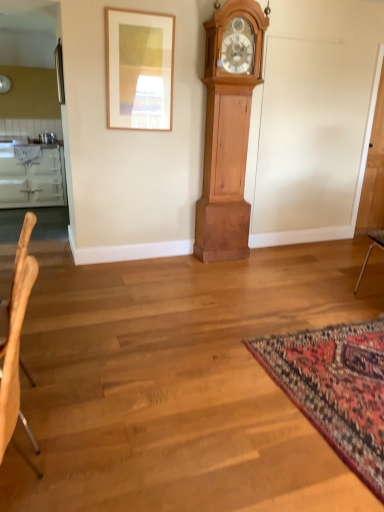
Question: Can you confirm if light brown wood chair at left is wider than carpet with intricate patterns at lower right?

Choices:
 (A) yes
 (B) no

Answer: (B)

Question: Is light brown wood chair at left taller than carpet with intricate patterns at lower right?

Choices:
 (A) no
 (B) yes

Answer: (B)

Question: Can you confirm if light brown wood chair at left is shorter than carpet with intricate patterns at lower right?

Choices:
 (A) no
 (B) yes

Answer: (A)

Question: Is light brown wood chair at left positioned before carpet with intricate patterns at lower right?

Choices:
 (A) no
 (B) yes

Answer: (B)

Question: Considering the relative sizes of light brown wood chair at left and carpet with intricate patterns at lower right in the image provided, is light brown wood chair at left thinner than carpet with intricate patterns at lower right?

Choices:
 (A) no
 (B) yes

Answer: (B)

Question: Considering the relative sizes of light brown wood chair at left and carpet with intricate patterns at lower right in the image provided, is light brown wood chair at left bigger than carpet with intricate patterns at lower right?

Choices:
 (A) no
 (B) yes

Answer: (B)

Question: From the image's perspective, is carpet with intricate patterns at lower right on light brown wood chair at left?

Choices:
 (A) yes
 (B) no

Answer: (B)

Question: Does carpet with intricate patterns at lower right lie in front of light brown wood chair at left?

Choices:
 (A) yes
 (B) no

Answer: (B)

Question: Considering the relative sizes of carpet with intricate patterns at lower right and light brown wood chair at left in the image provided, is carpet with intricate patterns at lower right wider than light brown wood chair at left?

Choices:
 (A) no
 (B) yes

Answer: (B)

Question: From the image's perspective, is carpet with intricate patterns at lower right located beneath light brown wood chair at left?

Choices:
 (A) yes
 (B) no

Answer: (A)

Question: Is light brown wood chair at left located within carpet with intricate patterns at lower right?

Choices:
 (A) no
 (B) yes

Answer: (A)

Question: Does carpet with intricate patterns at lower right have a smaller size compared to light brown wood chair at left?

Choices:
 (A) yes
 (B) no

Answer: (A)

Question: Is wooden picture frame at upper center to the left of light brown wood chair at left from the viewer's perspective?

Choices:
 (A) yes
 (B) no

Answer: (B)